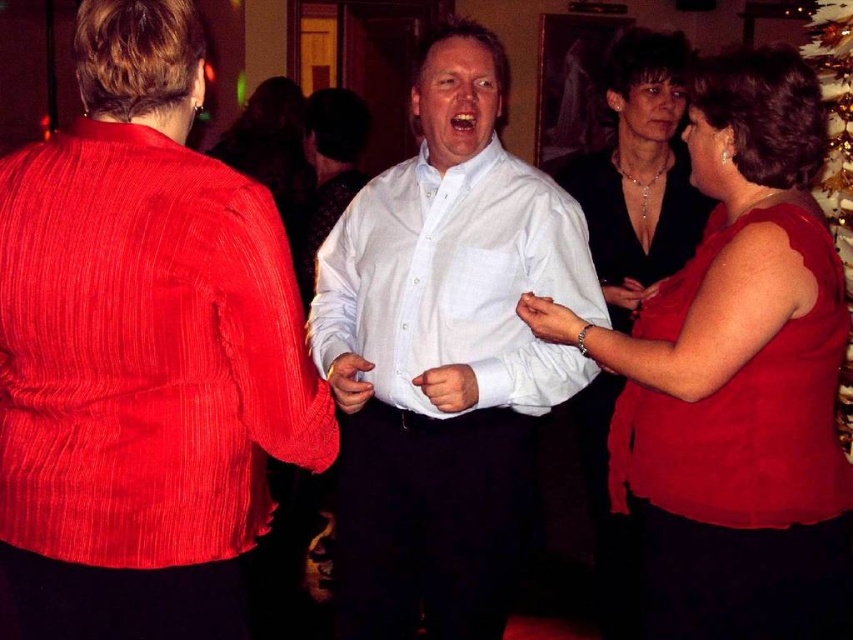
Question: Does white checkered shirt at center have a greater width compared to gold glittering christmas tree at upper right?

Choices:
 (A) yes
 (B) no

Answer: (A)

Question: Which point is farther to the camera?

Choices:
 (A) white matte shirt at center
 (B) white linen shirt at center
 (C) matte red dress at right
 (D) white checkered shirt at center

Answer: (D)

Question: Can you confirm if white linen shirt at center is positioned below matte red dress at right?

Choices:
 (A) yes
 (B) no

Answer: (B)

Question: Can you confirm if matte red blouse at center is smaller than gold glittering christmas tree at upper right?

Choices:
 (A) yes
 (B) no

Answer: (A)

Question: Among these objects, which one is farthest from the camera?

Choices:
 (A) gold glittering christmas tree at upper right
 (B) matte red dress at right
 (C) matte red blouse at center

Answer: (A)

Question: Estimate the real-world distances between objects in this image. Which object is closer to the white linen shirt at center?

Choices:
 (A) gold glittering christmas tree at upper right
 (B) matte red blouse at center
 (C) white matte shirt at center
 (D) white checkered shirt at center

Answer: (D)